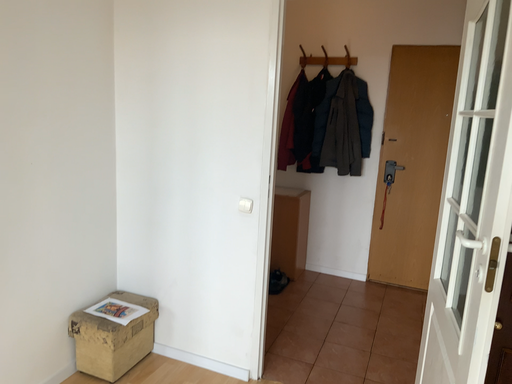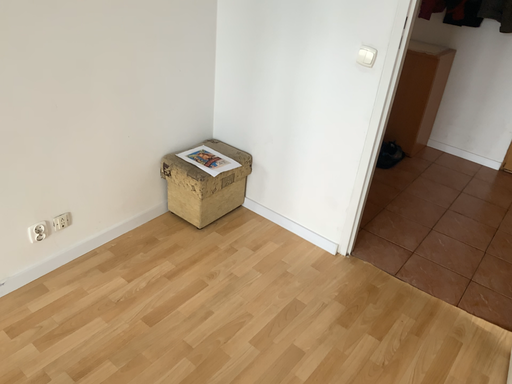
Question: How did the camera likely rotate when shooting the video?

Choices:
 (A) rotated upward
 (B) rotated downward

Answer: (B)